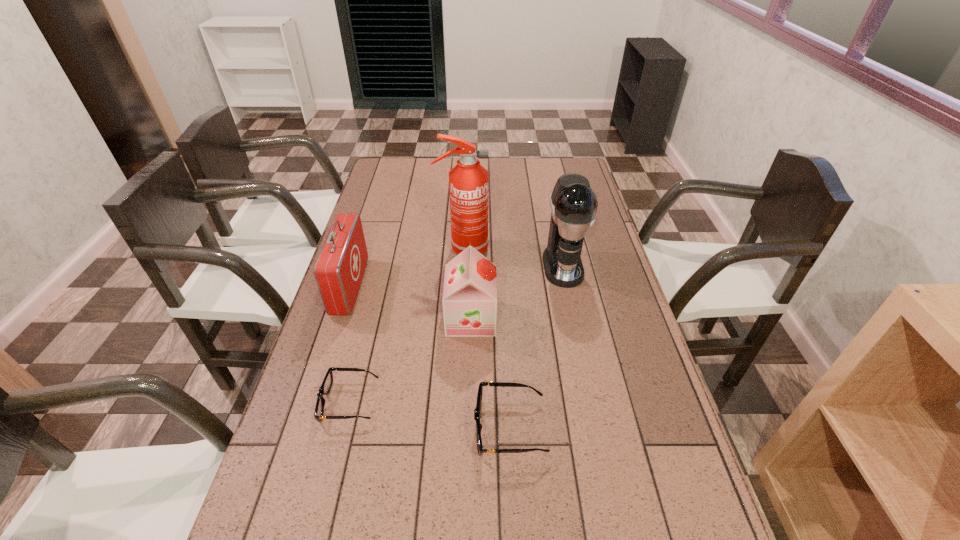
Locate an element on the screen. vacant area that lies between the fifth shortest object and the fire extinguisher is located at coordinates (513, 258).

What are the coordinates of `vacant area between the tallest object and the shortest object` in the screenshot? It's located at (406, 326).

Identify the location of free point between the shortest object and the soya milk. (410, 360).

Select which object appears as the closest to the second shortest object. Please provide its 2D coordinates. Your answer should be formatted as a tuple, i.e. [(x, y)], where the tuple contains the x and y coordinates of a point satisfying the conditions above.

[(469, 300)]

Point out which object is positioned as the nearest to the soya milk. Please provide its 2D coordinates. Your answer should be formatted as a tuple, i.e. [(x, y)], where the tuple contains the x and y coordinates of a point satisfying the conditions above.

[(573, 203)]

Image resolution: width=960 pixels, height=540 pixels. I want to click on free location that satisfies the following two spatial constraints: 1. place cup under the spout of the coffee maker; 2. on the front-facing side of the right sunglasses, so click(x=597, y=428).

At what (x,y) coordinates should I click in order to perform the action: click on vacant area in the image that satisfies the following two spatial constraints: 1. place cup under the spout of the coffee maker; 2. on the front-facing side of the second shortest object. Please return your answer as a coordinate pair (x, y). Image resolution: width=960 pixels, height=540 pixels. Looking at the image, I should click on (597, 428).

The image size is (960, 540). What are the coordinates of `free spot that satisfies the following two spatial constraints: 1. place cup under the spout of the rightmost object; 2. on the side of the first-aid kit with the first aid cross symbol` in the screenshot? It's located at (567, 287).